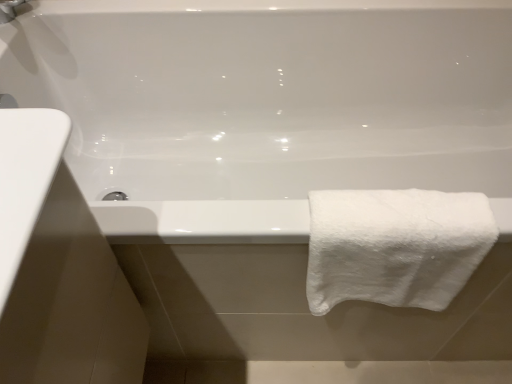
Question: Would you say white fluffy towel at right is outside matte silver faucet at upper left?

Choices:
 (A) no
 (B) yes

Answer: (B)

Question: Is white fluffy towel at right turned away from matte silver faucet at upper left?

Choices:
 (A) no
 (B) yes

Answer: (A)

Question: Can you confirm if white fluffy towel at right is taller than matte silver faucet at upper left?

Choices:
 (A) yes
 (B) no

Answer: (A)

Question: From the image's perspective, is white fluffy towel at right beneath matte silver faucet at upper left?

Choices:
 (A) no
 (B) yes

Answer: (B)

Question: Considering the relative sizes of white fluffy towel at right and matte silver faucet at upper left in the image provided, is white fluffy towel at right bigger than matte silver faucet at upper left?

Choices:
 (A) yes
 (B) no

Answer: (A)

Question: Is white fluffy towel at right further to the viewer compared to matte silver faucet at upper left?

Choices:
 (A) yes
 (B) no

Answer: (B)

Question: Is matte silver faucet at upper left far away from white fluffy towel at right?

Choices:
 (A) yes
 (B) no

Answer: (B)

Question: Is matte silver faucet at upper left facing towards white fluffy towel at right?

Choices:
 (A) yes
 (B) no

Answer: (A)

Question: Is matte silver faucet at upper left thinner than white fluffy towel at right?

Choices:
 (A) no
 (B) yes

Answer: (B)

Question: From a real-world perspective, is matte silver faucet at upper left physically above white fluffy towel at right?

Choices:
 (A) no
 (B) yes

Answer: (B)

Question: Is the depth of matte silver faucet at upper left less than that of white fluffy towel at right?

Choices:
 (A) yes
 (B) no

Answer: (B)

Question: Can you confirm if matte silver faucet at upper left is wider than white fluffy towel at right?

Choices:
 (A) yes
 (B) no

Answer: (B)

Question: Does point (12, 4) appear closer or farther from the camera than point (368, 236)?

Choices:
 (A) farther
 (B) closer

Answer: (A)